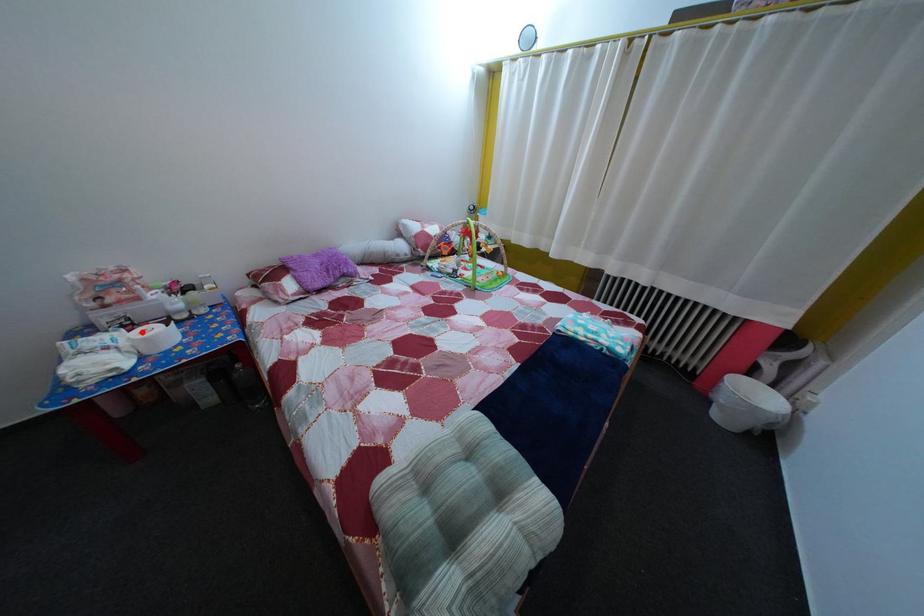
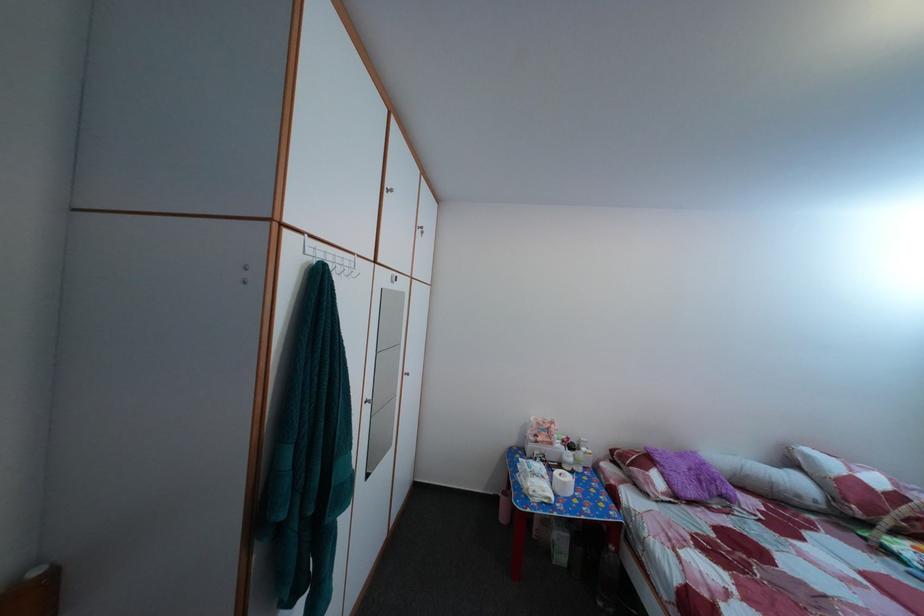
Locate, in the second image, the point that corresponds to the highlighted location in the first image.

(555, 469)